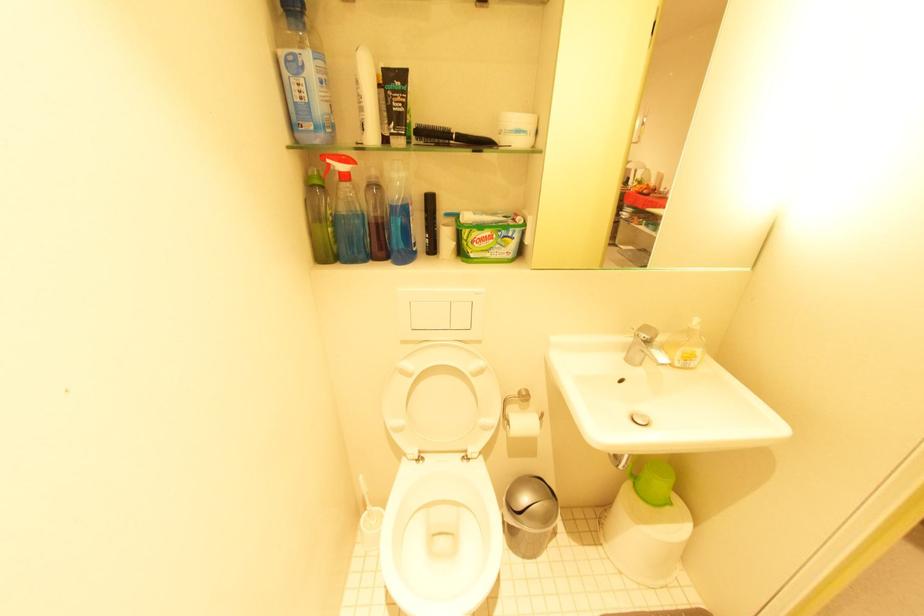
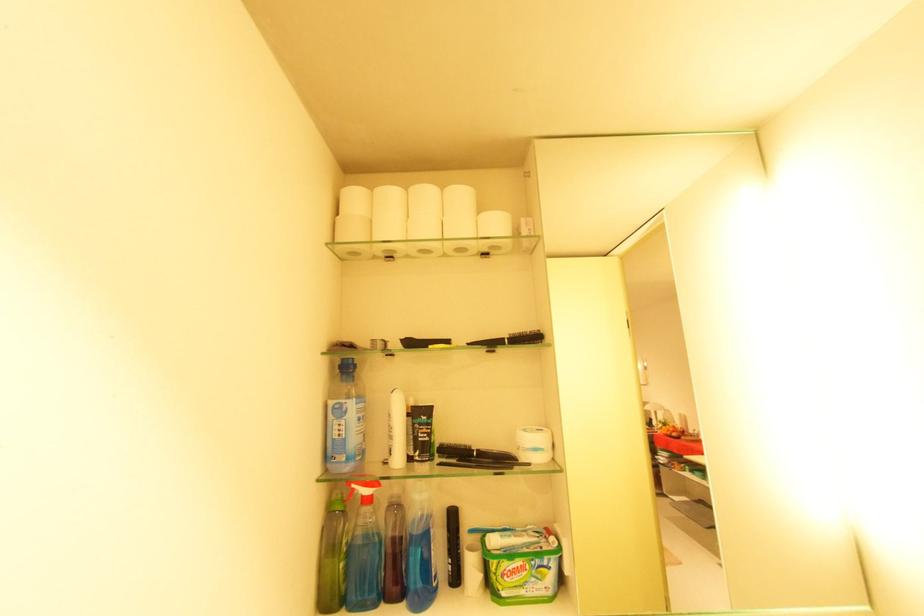
Find the pixel in the second image that matches [533,122] in the first image.

(549, 440)